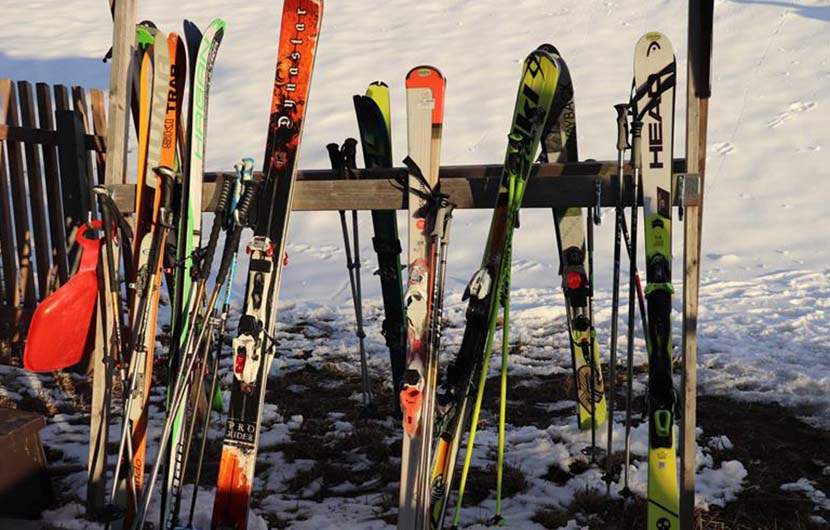
Where is `wooden plank`? The image size is (830, 530). wooden plank is located at coordinates (15, 112), (11, 251), (40, 183), (46, 162), (66, 157), (77, 96), (116, 120), (306, 206), (466, 171), (691, 120).